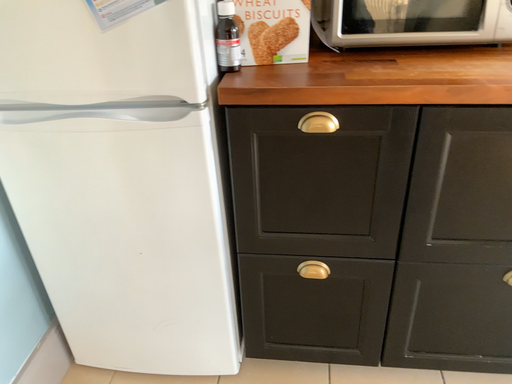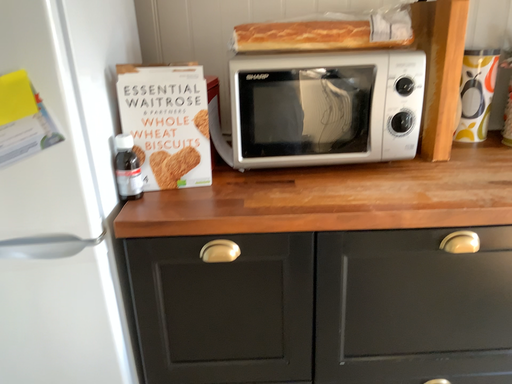
Question: Which way did the camera rotate in the video?

Choices:
 (A) rotated upward
 (B) rotated downward

Answer: (A)